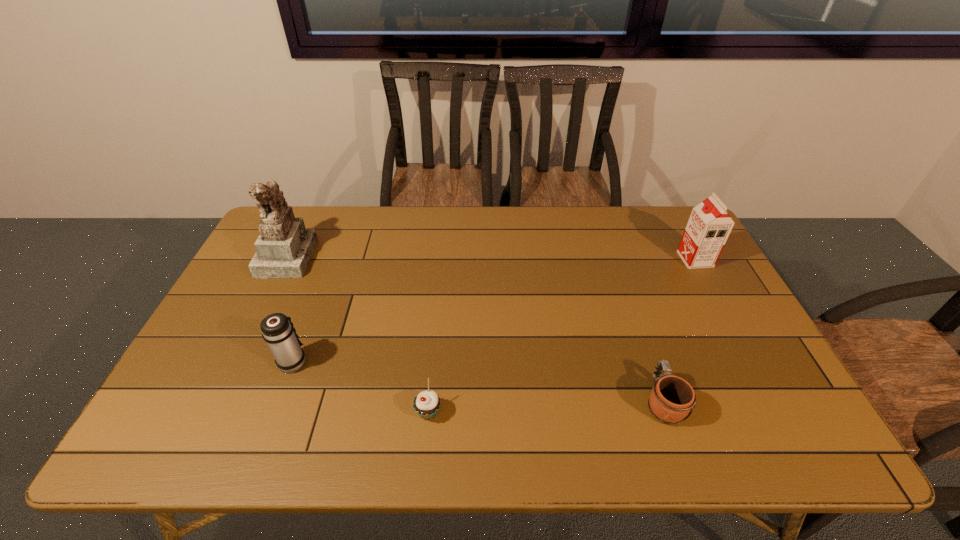
Where is `object present at the left edge`? object present at the left edge is located at coordinates (284, 247).

This screenshot has width=960, height=540. I want to click on object that is at the right edge, so click(x=709, y=225).

Locate an element on the screen. The width and height of the screenshot is (960, 540). object located at the far left corner is located at coordinates (284, 247).

At what (x,y) coordinates should I click in order to perform the action: click on free region at the far edge of the desktop. Please return your answer as a coordinate pair (x, y). Image resolution: width=960 pixels, height=540 pixels. Looking at the image, I should click on (562, 212).

This screenshot has width=960, height=540. In the image, there is a desktop. Find the location of `vacant space at the left edge`. vacant space at the left edge is located at coordinates (248, 350).

This screenshot has width=960, height=540. In order to click on vacant space at the right edge in this screenshot , I will do `click(729, 325)`.

Find the location of a particular element. blank region between the mug and the leftmost object is located at coordinates (x=475, y=328).

In order to click on free space between the second object from left to right and the leftmost object in this screenshot , I will do `click(290, 309)`.

In order to click on empty space between the cupcake and the rightmost object in this screenshot , I will do `click(562, 336)`.

This screenshot has width=960, height=540. I want to click on empty space that is in between the third farthest object and the third object from left to right, so click(x=361, y=387).